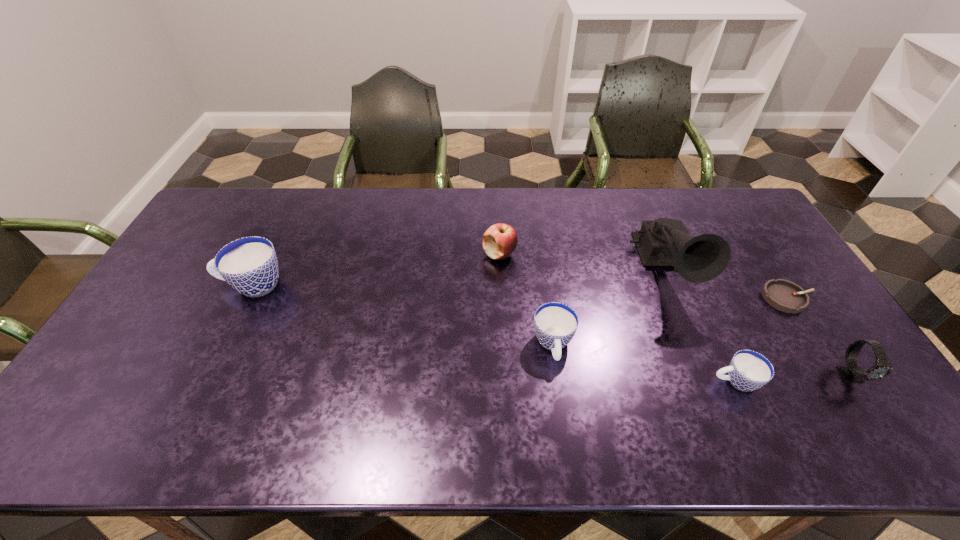
At what (x,y) coordinates should I click in order to perform the action: click on cup located at the near edge. Please return your answer as a coordinate pair (x, y). The width and height of the screenshot is (960, 540). Looking at the image, I should click on click(x=748, y=370).

This screenshot has height=540, width=960. Identify the location of watch that is positioned at the near edge. (x=851, y=373).

At what (x,y) coordinates should I click in order to perform the action: click on ashtray at the right edge. Please return your answer as a coordinate pair (x, y). The image size is (960, 540). Looking at the image, I should click on (784, 295).

You are a GUI agent. You are given a task and a screenshot of the screen. Output one action in this format:
    pyautogui.click(x=<x>, y=<y>)
    Task: Click on the watch that is at the right edge
    The image size is (960, 540).
    Given the screenshot: What is the action you would take?
    pyautogui.click(x=851, y=373)

Find the location of a particular element. This screenshot has width=960, height=540. object that is positioned at the near right corner is located at coordinates (851, 373).

Image resolution: width=960 pixels, height=540 pixels. In the image, there is a desktop. Identify the location of vacant space at the far edge. (448, 208).

This screenshot has height=540, width=960. Identify the location of free space at the near edge of the desktop. (717, 384).

At what (x,y) coordinates should I click in order to perform the action: click on free location at the left edge. Please return your answer as a coordinate pair (x, y). The image size is (960, 540). Looking at the image, I should click on tap(160, 284).

The height and width of the screenshot is (540, 960). Identify the location of free spot at the right edge of the desktop. (786, 261).

In the image, there is a desktop. Identify the location of vacant space at the far left corner. (230, 192).